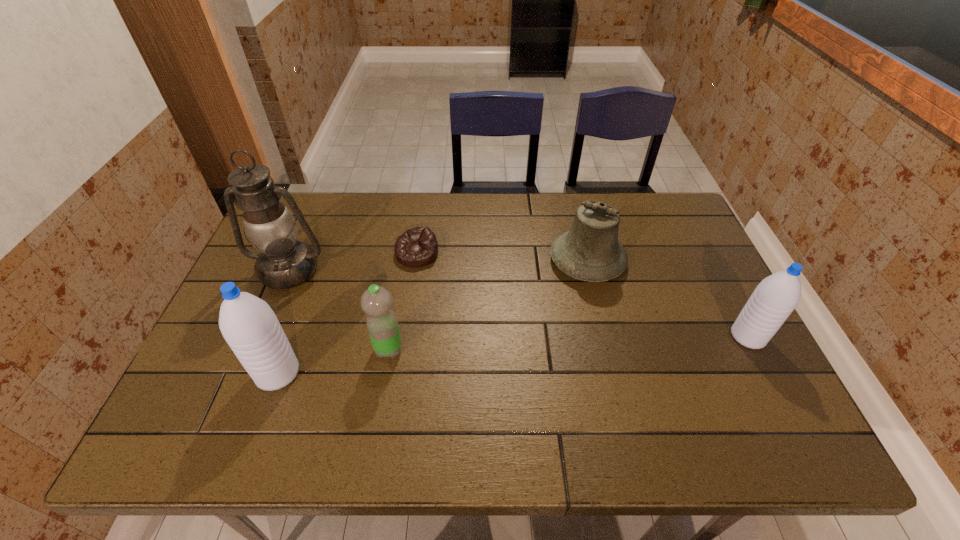
To make them evenly spaced by inserting another water_bottle among them, please locate a vacant spot for this new water_bottle. Please provide its 2D coordinates. Your answer should be formatted as a tuple, i.e. [(x, y)], where the tuple contains the x and y coordinates of a point satisfying the conditions above.

[(521, 354)]